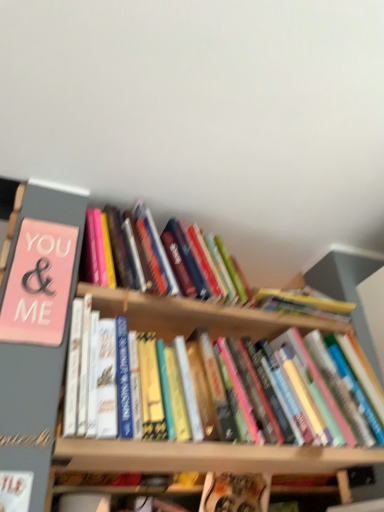
Question: Which direction should I rotate to look at hardcover book at center, which ranks as the first book in bottom-to-top order, — up or down?

Choices:
 (A) up
 (B) down

Answer: (B)

Question: From a real-world perspective, is white paper at lower left, which ranks as the second book in bottom-to-top order, over hardcover book at center, which is counted as the 5th book, starting from the bottom?

Choices:
 (A) yes
 (B) no

Answer: (B)

Question: Can you confirm if white paper at lower left, which is the 4th book from top to bottom, is positioned to the right of hardcover book at center, which is counted as the 5th book, starting from the bottom?

Choices:
 (A) no
 (B) yes

Answer: (A)

Question: Is white paper at lower left, which is the 4th book from top to bottom, placed right next to hardcover book at center, marked as the 1th book in a top-to-bottom arrangement?

Choices:
 (A) no
 (B) yes

Answer: (A)

Question: Can hardcover book at center, marked as the 1th book in a top-to-bottom arrangement, be found inside white paper at lower left, which ranks as the second book in bottom-to-top order?

Choices:
 (A) no
 (B) yes

Answer: (A)

Question: Is white paper at lower left, which is the 4th book from top to bottom, outside hardcover book at center, which is counted as the 5th book, starting from the bottom?

Choices:
 (A) no
 (B) yes

Answer: (B)

Question: Could you tell me if white paper at lower left, which ranks as the second book in bottom-to-top order, is turned towards hardcover book at center, marked as the 1th book in a top-to-bottom arrangement?

Choices:
 (A) no
 (B) yes

Answer: (A)

Question: Can you confirm if hardcover book at center, which ranks as the first book in bottom-to-top order, is taller than white paper at lower left, which ranks as the second book in bottom-to-top order?

Choices:
 (A) no
 (B) yes

Answer: (A)

Question: From a real-world perspective, is hardcover book at center, acting as the 5th book starting from the top, on top of white paper at lower left, which is the 4th book from top to bottom?

Choices:
 (A) yes
 (B) no

Answer: (A)

Question: From the image's perspective, is hardcover book at center, acting as the 5th book starting from the top, below white paper at lower left, which ranks as the second book in bottom-to-top order?

Choices:
 (A) no
 (B) yes

Answer: (B)

Question: Does hardcover book at center, acting as the 5th book starting from the top, appear on the right side of white paper at lower left, which ranks as the second book in bottom-to-top order?

Choices:
 (A) yes
 (B) no

Answer: (A)

Question: Is hardcover book at center, which ranks as the first book in bottom-to-top order, aimed at white paper at lower left, which is the 4th book from top to bottom?

Choices:
 (A) no
 (B) yes

Answer: (A)

Question: Can you confirm if hardcover book at center, which ranks as the first book in bottom-to-top order, is shorter than white paper at lower left, which ranks as the second book in bottom-to-top order?

Choices:
 (A) no
 (B) yes

Answer: (B)

Question: Does hardcover book at center, which is counted as the 5th book, starting from the bottom, have a lesser height compared to hardcover book at center, acting as the 5th book starting from the top?

Choices:
 (A) no
 (B) yes

Answer: (A)